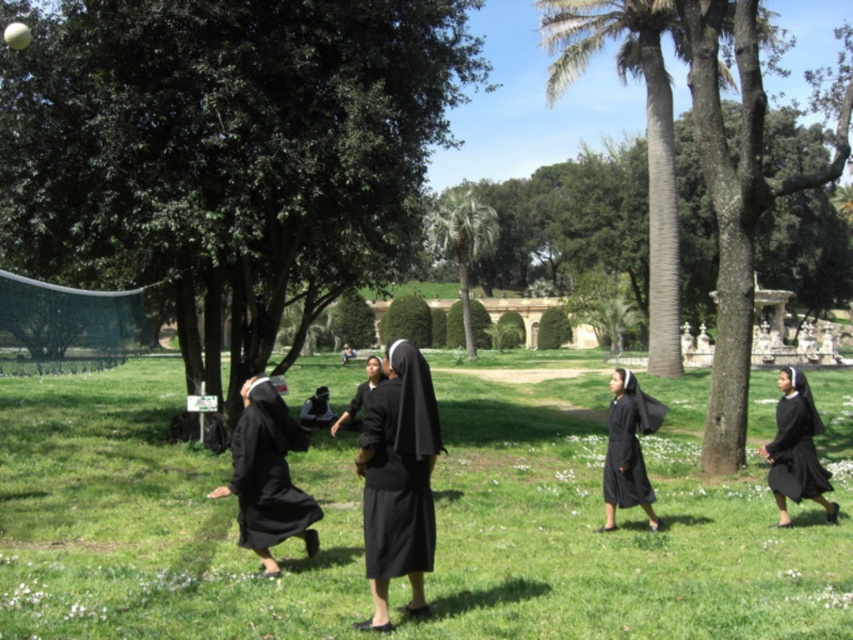
In the scene shown: You are a photographer trying to capture a shot of the green grass at center and the matte black habit at center. Based on their sizes, which one would appear wider in the frame?

The green grass at center appears wider in the frame because its width is larger than that of the matte black habit at center.

You are a photographer setting up a shot in the park scene. You need to ensure that the green grass at center and the black matte dress at right are both in frame. Considering their sizes, which object should you focus on first to ensure they both fit well in the composition?

The green grass at center has a larger width than the black matte dress at right, so you should focus on framing the green grass at center first to ensure both objects fit well in the composition.